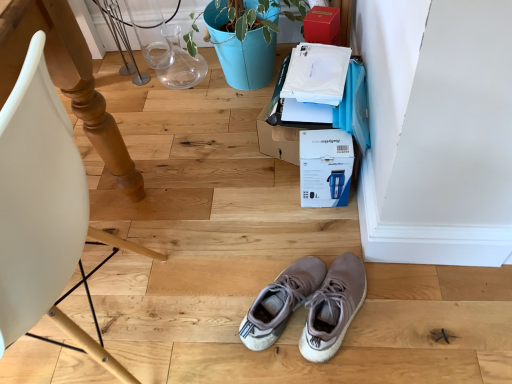
Locate an element on the screen. This screenshot has width=512, height=384. blue cardboard box at center, which is the second cardboard box in top-to-bottom order is located at coordinates (325, 167).

Find the location of `light gray suede sneakers at center`. light gray suede sneakers at center is located at coordinates (308, 305).

From a real-world perspective, relative to matte cardboard box at upper right, the first cardboard box positioned from the top, is matte wood chair at left vertically above or below?

From a real-world perspective, matte wood chair at left is physically above matte cardboard box at upper right, the first cardboard box positioned from the top.

Considering the positions of objects matte wood chair at left and matte cardboard box at upper right, which appears as the 2th cardboard box when ordered from the bottom, in the image provided, who is in front, matte wood chair at left or matte cardboard box at upper right, which appears as the 2th cardboard box when ordered from the bottom,?

Positioned in front is matte wood chair at left.

Between matte wood chair at left and matte cardboard box at upper right, the first cardboard box positioned from the top, which one has larger width?

matte wood chair at left is wider.

In the scene shown: Which point is more distant from viewer, (321, 138) or (313, 29)?

The point (313, 29) is farther.

From a real-world perspective, is blue cardboard box at center, which is the second cardboard box in top-to-bottom order, on matte cardboard box at upper right, which appears as the 2th cardboard box when ordered from the bottom?

No.

How many degrees apart are the facing directions of blue cardboard box at center, which is the second cardboard box in top-to-bottom order, and matte cardboard box at upper right, the first cardboard box positioned from the top?

The facing directions of blue cardboard box at center, which is the second cardboard box in top-to-bottom order, and matte cardboard box at upper right, the first cardboard box positioned from the top, are 27.1 degrees apart.

Consider the image. Relative to matte cardboard box at upper right, the first cardboard box positioned from the top, is blue cardboard box at center, which is the second cardboard box in top-to-bottom order, in front or behind?

Clearly, blue cardboard box at center, which is the second cardboard box in top-to-bottom order, is in front of matte cardboard box at upper right, the first cardboard box positioned from the top.

From a real-world perspective, is light gray suede sneakers at center beneath blue cardboard box at center, which is counted as the 1th cardboard box, starting from the bottom?

Yes, from a real-world perspective, light gray suede sneakers at center is below blue cardboard box at center, which is counted as the 1th cardboard box, starting from the bottom.

Are light gray suede sneakers at center and blue cardboard box at center, which is counted as the 1th cardboard box, starting from the bottom, making contact?

No, light gray suede sneakers at center is not with blue cardboard box at center, which is counted as the 1th cardboard box, starting from the bottom.

Based on the photo, is light gray suede sneakers at center at the left side of blue cardboard box at center, which is the second cardboard box in top-to-bottom order?

Correct, you'll find light gray suede sneakers at center to the left of blue cardboard box at center, which is the second cardboard box in top-to-bottom order.

Considering the relative sizes of light gray suede sneakers at center and blue cardboard box at center, which is counted as the 1th cardboard box, starting from the bottom, in the image provided, is light gray suede sneakers at center taller than blue cardboard box at center, which is counted as the 1th cardboard box, starting from the bottom,?

No.

Consider the image. Is matte cardboard box at upper right, which appears as the 2th cardboard box when ordered from the bottom, with blue cardboard box at center, which is the second cardboard box in top-to-bottom order?

No, matte cardboard box at upper right, which appears as the 2th cardboard box when ordered from the bottom, is not touching blue cardboard box at center, which is the second cardboard box in top-to-bottom order.

Considering the positions of objects matte cardboard box at upper right, the first cardboard box positioned from the top, and blue cardboard box at center, which is counted as the 1th cardboard box, starting from the bottom, in the image provided, who is more to the right, matte cardboard box at upper right, the first cardboard box positioned from the top, or blue cardboard box at center, which is counted as the 1th cardboard box, starting from the bottom,?

Positioned to the right is matte cardboard box at upper right, the first cardboard box positioned from the top.

From a real-world perspective, which object rests below the other?

In real-world perspective, blue cardboard box at center, which is the second cardboard box in top-to-bottom order, is lower.

Can you tell me how much matte cardboard box at upper right, which appears as the 2th cardboard box when ordered from the bottom, and blue cardboard box at center, which is counted as the 1th cardboard box, starting from the bottom, differ in facing direction?

They differ by 27.1 degrees in their facing directions.

Looking at their sizes, would you say blue cardboard box at center, which is the second cardboard box in top-to-bottom order, is wider or thinner than light gray suede sneakers at center?

Clearly, blue cardboard box at center, which is the second cardboard box in top-to-bottom order, has less width compared to light gray suede sneakers at center.

Who is shorter, blue cardboard box at center, which is the second cardboard box in top-to-bottom order, or light gray suede sneakers at center?

light gray suede sneakers at center is shorter.

Between blue cardboard box at center, which is counted as the 1th cardboard box, starting from the bottom, and light gray suede sneakers at center, which one has larger size?

With larger size is blue cardboard box at center, which is counted as the 1th cardboard box, starting from the bottom.

Identify the location of footwear below the blue cardboard box at center, which is counted as the 1th cardboard box, starting from the bottom (from the image's perspective). The width and height of the screenshot is (512, 384). (308, 305).

How much distance is there between blue cardboard box at center, which is counted as the 1th cardboard box, starting from the bottom, and matte wood chair at left?

blue cardboard box at center, which is counted as the 1th cardboard box, starting from the bottom, and matte wood chair at left are 67.46 centimeters apart from each other.

Who is bigger, blue cardboard box at center, which is the second cardboard box in top-to-bottom order, or matte wood chair at left?

With larger size is matte wood chair at left.

In the scene shown: Could you tell me if blue cardboard box at center, which is counted as the 1th cardboard box, starting from the bottom, is facing matte wood chair at left?

No, blue cardboard box at center, which is counted as the 1th cardboard box, starting from the bottom, is not oriented towards matte wood chair at left.

In terms of height, does blue cardboard box at center, which is the second cardboard box in top-to-bottom order, look taller or shorter compared to matte wood chair at left?

blue cardboard box at center, which is the second cardboard box in top-to-bottom order, is shorter than matte wood chair at left.

Locate an element on the screen. The image size is (512, 384). footwear that appears below the matte cardboard box at upper right, which appears as the 2th cardboard box when ordered from the bottom (from a real-world perspective) is located at coordinates (308, 305).

How different are the orientations of light gray suede sneakers at center and matte cardboard box at upper right, which appears as the 2th cardboard box when ordered from the bottom, in degrees?

The angular difference between light gray suede sneakers at center and matte cardboard box at upper right, which appears as the 2th cardboard box when ordered from the bottom, is 3.39 degrees.

Is point (356, 262) positioned in front of point (317, 35)?

Yes, it is in front of point (317, 35).

Which of these two, light gray suede sneakers at center or matte cardboard box at upper right, the first cardboard box positioned from the top, stands shorter?

Standing shorter between the two is light gray suede sneakers at center.

Locate an element on the screen. The height and width of the screenshot is (384, 512). chair lying below the matte cardboard box at upper right, the first cardboard box positioned from the top (from the image's perspective) is located at coordinates (42, 210).

The image size is (512, 384). Find the location of `cardboard box that appears above the blue cardboard box at center, which is counted as the 1th cardboard box, starting from the bottom (from the image's perspective)`. cardboard box that appears above the blue cardboard box at center, which is counted as the 1th cardboard box, starting from the bottom (from the image's perspective) is located at coordinates (322, 25).

From the image, which object appears to be farther from matte cardboard box at upper right, which appears as the 2th cardboard box when ordered from the bottom, blue cardboard box at center, which is counted as the 1th cardboard box, starting from the bottom, or matte wood chair at left?

matte wood chair at left is positioned further to the anchor matte cardboard box at upper right, which appears as the 2th cardboard box when ordered from the bottom.

Looking at the image, which one is located further to light gray suede sneakers at center, matte wood chair at left or blue cardboard box at center, which is counted as the 1th cardboard box, starting from the bottom?

matte wood chair at left is positioned further to the anchor light gray suede sneakers at center.

Estimate the real-world distances between objects in this image. Which object is closer to matte wood chair at left, light gray suede sneakers at center or blue cardboard box at center, which is counted as the 1th cardboard box, starting from the bottom?

light gray suede sneakers at center.

Which object lies nearer to the anchor point matte wood chair at left, matte cardboard box at upper right, the first cardboard box positioned from the top, or light gray suede sneakers at center?

light gray suede sneakers at center is closer to matte wood chair at left.

When comparing their distances from blue cardboard box at center, which is the second cardboard box in top-to-bottom order, does light gray suede sneakers at center or matte wood chair at left seem closer?

light gray suede sneakers at center.

Which object lies nearer to the anchor point blue cardboard box at center, which is the second cardboard box in top-to-bottom order, matte cardboard box at upper right, the first cardboard box positioned from the top, or light gray suede sneakers at center?

light gray suede sneakers at center is closer to blue cardboard box at center, which is the second cardboard box in top-to-bottom order.

Which object lies nearer to the anchor point matte wood chair at left, blue cardboard box at center, which is counted as the 1th cardboard box, starting from the bottom, or matte cardboard box at upper right, the first cardboard box positioned from the top?

blue cardboard box at center, which is counted as the 1th cardboard box, starting from the bottom, is closer to matte wood chair at left.

Looking at the image, which one is located closer to matte wood chair at left, blue cardboard box at center, which is counted as the 1th cardboard box, starting from the bottom, or light gray suede sneakers at center?

The object closer to matte wood chair at left is light gray suede sneakers at center.

Where is `cardboard box positioned between matte wood chair at left and matte cardboard box at upper right, the first cardboard box positioned from the top, from near to far`? Image resolution: width=512 pixels, height=384 pixels. cardboard box positioned between matte wood chair at left and matte cardboard box at upper right, the first cardboard box positioned from the top, from near to far is located at coordinates (325, 167).

Identify the location of footwear positioned between matte wood chair at left and blue cardboard box at center, which is counted as the 1th cardboard box, starting from the bottom, from near to far. (308, 305).

Locate an element on the screen. This screenshot has height=384, width=512. cardboard box between matte cardboard box at upper right, the first cardboard box positioned from the top, and light gray suede sneakers at center from top to bottom is located at coordinates (325, 167).

The width and height of the screenshot is (512, 384). I want to click on footwear between matte wood chair at left and matte cardboard box at upper right, the first cardboard box positioned from the top, from front to back, so click(308, 305).